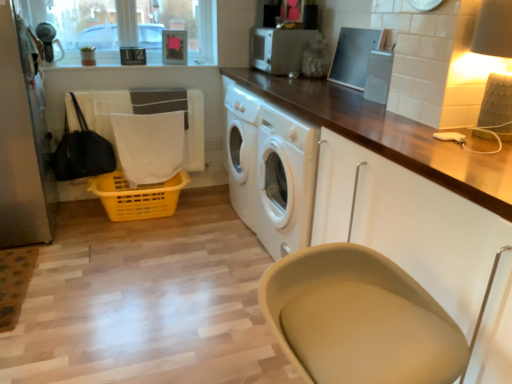
Question: Does clear glass window screen at upper left lie in front of matte cream lampshade at upper right?

Choices:
 (A) yes
 (B) no

Answer: (B)

Question: Considering the relative sizes of clear glass window screen at upper left and matte cream lampshade at upper right in the image provided, is clear glass window screen at upper left smaller than matte cream lampshade at upper right?

Choices:
 (A) no
 (B) yes

Answer: (A)

Question: Would you say matte cream lampshade at upper right is part of clear glass window screen at upper left's contents?

Choices:
 (A) no
 (B) yes

Answer: (A)

Question: Could you tell me if clear glass window screen at upper left is turned towards matte cream lampshade at upper right?

Choices:
 (A) no
 (B) yes

Answer: (B)

Question: Is clear glass window screen at upper left further to camera compared to matte cream lampshade at upper right?

Choices:
 (A) yes
 (B) no

Answer: (A)

Question: From a real-world perspective, is white fabric at lower left physically located above or below matte cream lampshade at upper right?

Choices:
 (A) above
 (B) below

Answer: (B)

Question: Would you say white fabric at lower left is inside or outside matte cream lampshade at upper right?

Choices:
 (A) outside
 (B) inside

Answer: (A)

Question: In the image, is white fabric at lower left positioned in front of or behind matte cream lampshade at upper right?

Choices:
 (A) front
 (B) behind

Answer: (B)

Question: Considering the positions of white fabric at lower left and matte cream lampshade at upper right in the image, is white fabric at lower left taller or shorter than matte cream lampshade at upper right?

Choices:
 (A) short
 (B) tall

Answer: (B)

Question: In the image, is beige fabric feeding chair at lower center on the left side or the right side of white fabric laundry at left?

Choices:
 (A) left
 (B) right

Answer: (B)

Question: In the image, is beige fabric feeding chair at lower center positioned in front of or behind white fabric laundry at left?

Choices:
 (A) front
 (B) behind

Answer: (A)

Question: From a real-world perspective, relative to white fabric laundry at left, is beige fabric feeding chair at lower center vertically above or below?

Choices:
 (A) below
 (B) above

Answer: (A)

Question: Is beige fabric feeding chair at lower center spatially inside white fabric laundry at left, or outside of it?

Choices:
 (A) inside
 (B) outside

Answer: (B)

Question: From a real-world perspective, relative to satin silver toaster at upper center, the second appliance ordered from the bottom, is white fabric at lower left vertically above or below?

Choices:
 (A) above
 (B) below

Answer: (B)

Question: Considering the positions of white fabric at lower left and satin silver toaster at upper center, the first appliance from the left, in the image, is white fabric at lower left wider or thinner than satin silver toaster at upper center, the first appliance from the left,?

Choices:
 (A) wide
 (B) thin

Answer: (B)